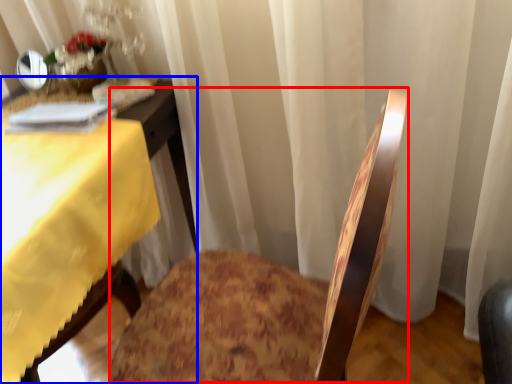
Question: Which object is further to the camera taking this photo, rocking chair (highlighted by a red box) or table (highlighted by a blue box)?

Choices:
 (A) rocking chair
 (B) table

Answer: (B)